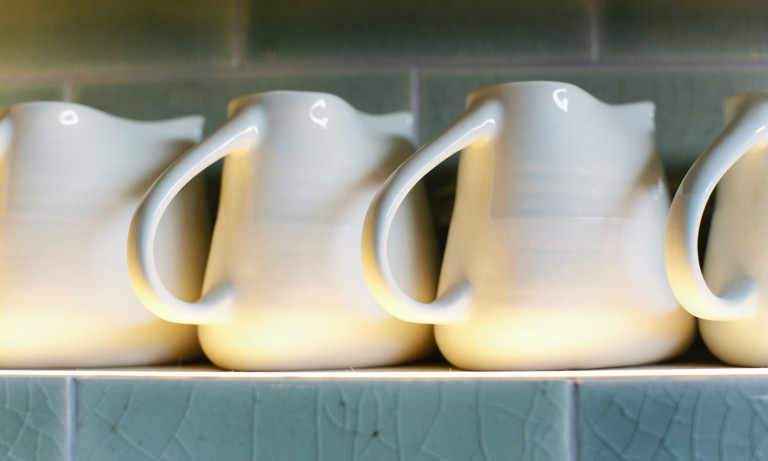
I want to click on tiles, so click(x=25, y=423), click(x=245, y=422), click(x=649, y=408), click(x=21, y=86), click(x=44, y=59), click(x=100, y=93), click(x=315, y=38), click(x=444, y=102), click(x=674, y=36).